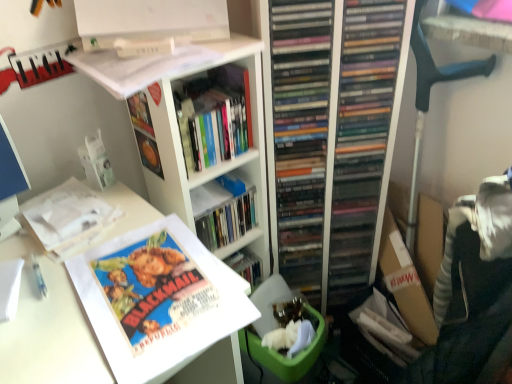
Locate an element on the screen. Image resolution: width=512 pixels, height=384 pixels. free spot below matte paper poster at lower left, which appears as the third book when viewed from the top (from a real-world perspective) is located at coordinates (150, 296).